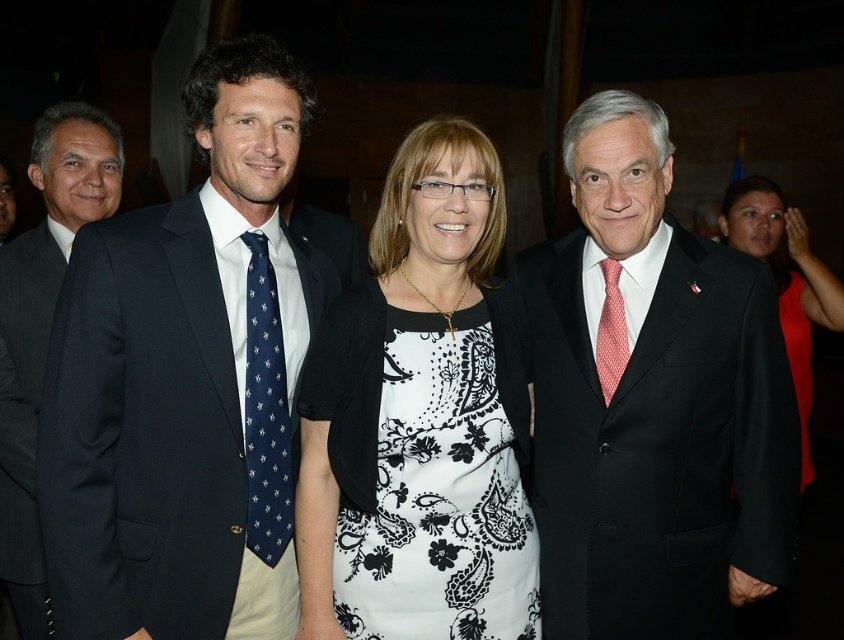
You are a photographer trying to adjust the lighting for two men wearing ties. You see the navy silk tie at left and the red dotted tie at right. Which tie is positioned more to the left side?

The navy silk tie at left is positioned more to the left side than the red dotted tie at right.

You are a photographer adjusting the camera settings to ensure both the navy silk tie at left and the red dotted tie at right are in focus. Which tie requires you to adjust the focus closer to the camera?

The navy silk tie at left requires adjusting the focus closer to the camera because it is larger in size compared to the red dotted tie at right, indicating it might be nearer.

You are standing in the same room as the image and want to touch the point at coordinates (187, 381). Which object from the scene would you be touching?

The point at coordinates (187, 381) is on the matte black suit at left, so touching that point would mean you are touching the matte black suit at left.